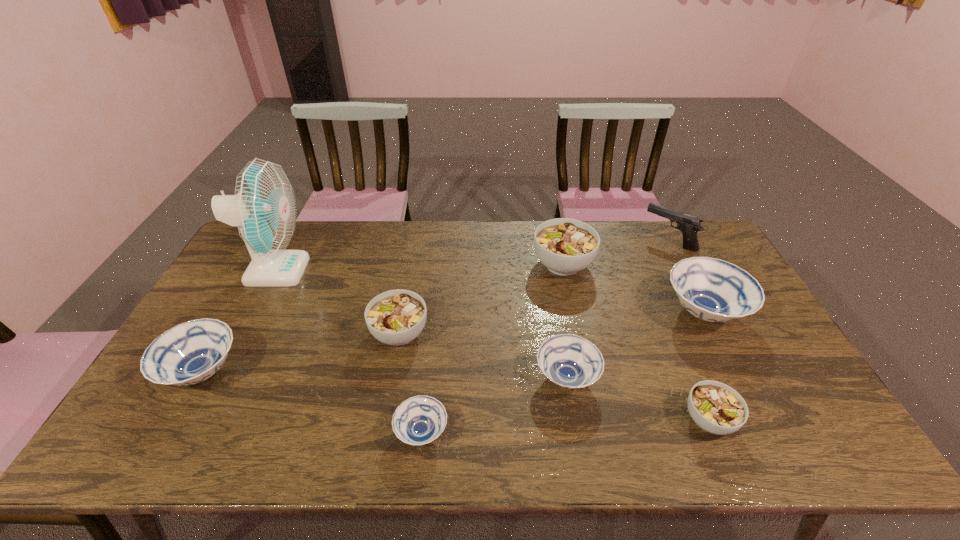
Locate an element on the screen. The image size is (960, 540). free spot between the second nearest white soup bowl and the black gun is located at coordinates click(x=534, y=287).

Find the location of a particular element. The width and height of the screenshot is (960, 540). free spot between the second biggest blue soup bowl and the second nearest white soup bowl is located at coordinates (301, 353).

This screenshot has width=960, height=540. In order to click on unoccupied area between the leftmost blue soup bowl and the biggest blue soup bowl in this screenshot , I will do `click(453, 342)`.

Where is `empty space that is in between the rightmost blue soup bowl and the third biggest blue soup bowl`? This screenshot has height=540, width=960. empty space that is in between the rightmost blue soup bowl and the third biggest blue soup bowl is located at coordinates (635, 345).

This screenshot has width=960, height=540. I want to click on empty location between the black gun and the third blue soup bowl from left to right, so click(x=617, y=309).

Where is `vacant space that's between the shortest soup bowl and the second white soup bowl from left to right`? This screenshot has width=960, height=540. vacant space that's between the shortest soup bowl and the second white soup bowl from left to right is located at coordinates (492, 348).

Image resolution: width=960 pixels, height=540 pixels. Find the location of `object that is the third closest to the biggest white soup bowl`. object that is the third closest to the biggest white soup bowl is located at coordinates (569, 361).

Find the location of a particular element. object that is the second closest to the second nearest white soup bowl is located at coordinates (264, 208).

What are the coordinates of `soup bowl that is the nearest to the smallest blue soup bowl` in the screenshot? It's located at (396, 317).

Choose which soup bowl is the fifth nearest neighbor to the second nearest white soup bowl. Please provide its 2D coordinates. Your answer should be formatted as a tuple, i.e. [(x, y)], where the tuple contains the x and y coordinates of a point satisfying the conditions above.

[(717, 408)]